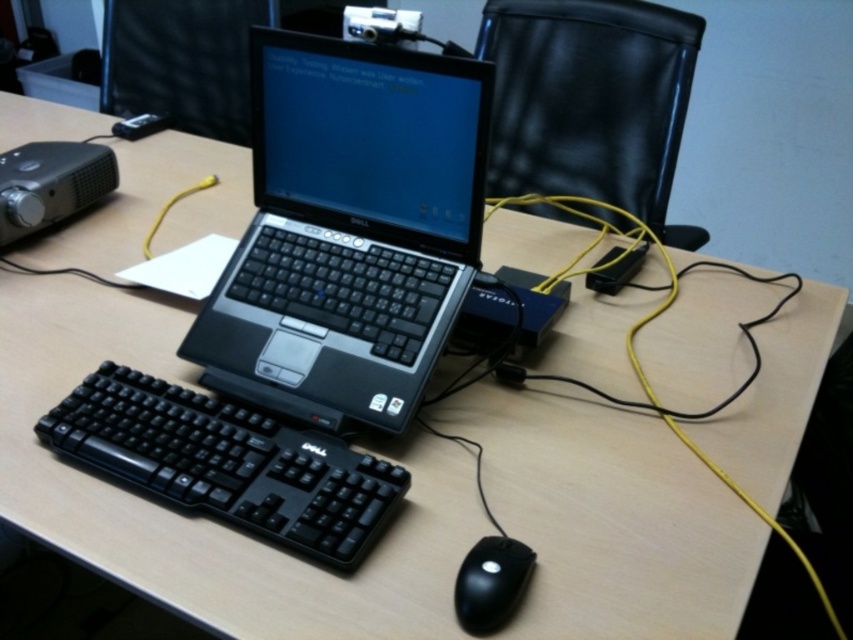
Consider the image. You are organizing your desk and need to place the black plastic laptop at center and the black matte mouse at lower center side by side. Which object requires more horizontal space due to its greater width?

The black plastic laptop at center requires more horizontal space because its width surpasses that of the black matte mouse at lower center.